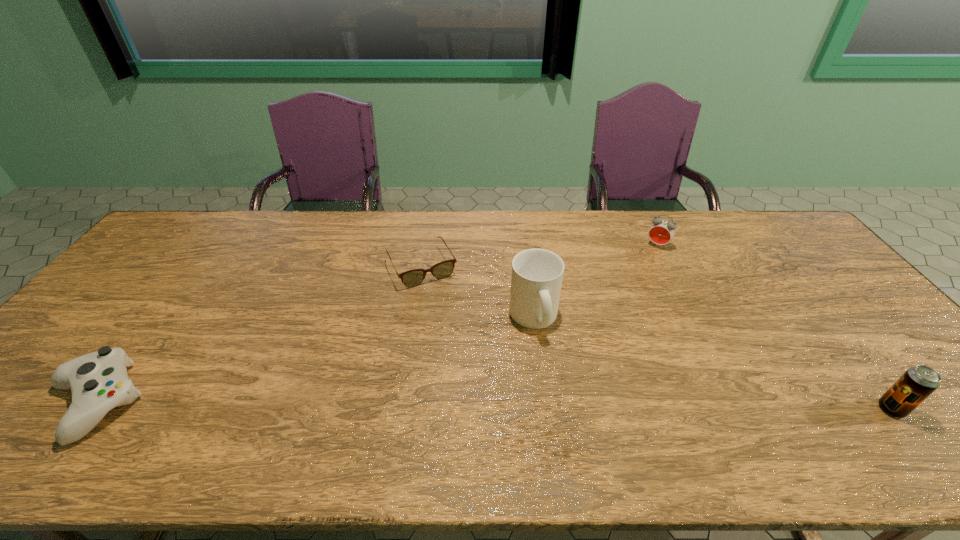
Where is `object that is the closest to the alarm clock`? object that is the closest to the alarm clock is located at coordinates (537, 274).

At what (x,y) coordinates should I click in order to perform the action: click on object that is the third nearest to the control. Please return your answer as a coordinate pair (x, y). Looking at the image, I should click on click(x=661, y=232).

I want to click on free location that satisfies the following two spatial constraints: 1. on the back side of the fourth object from right to left; 2. on the left side of the fourth object from left to right, so click(x=425, y=245).

The height and width of the screenshot is (540, 960). Find the location of `vacant region that satisfies the following two spatial constraints: 1. on the back side of the shortest object; 2. on the right side of the alarm clock`. vacant region that satisfies the following two spatial constraints: 1. on the back side of the shortest object; 2. on the right side of the alarm clock is located at coordinates (425, 245).